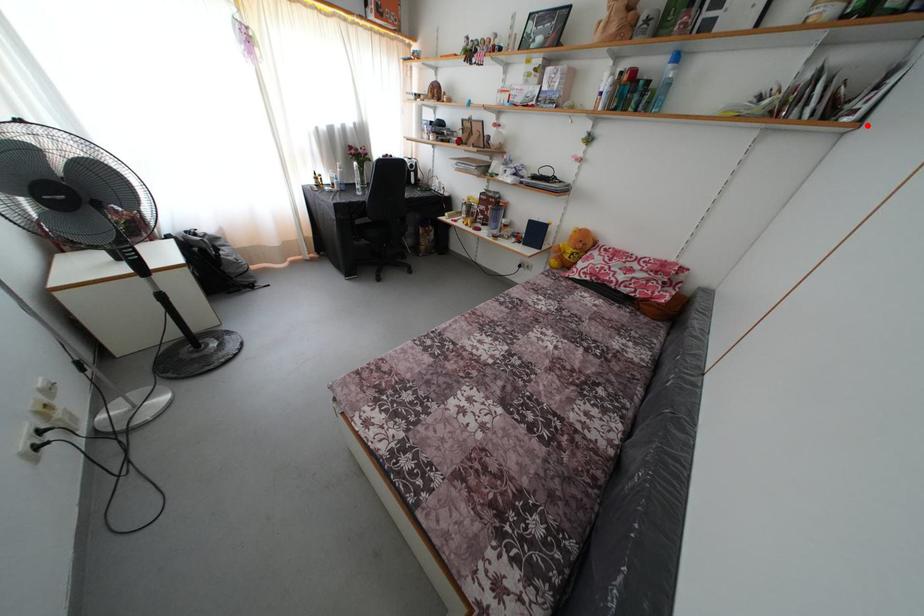
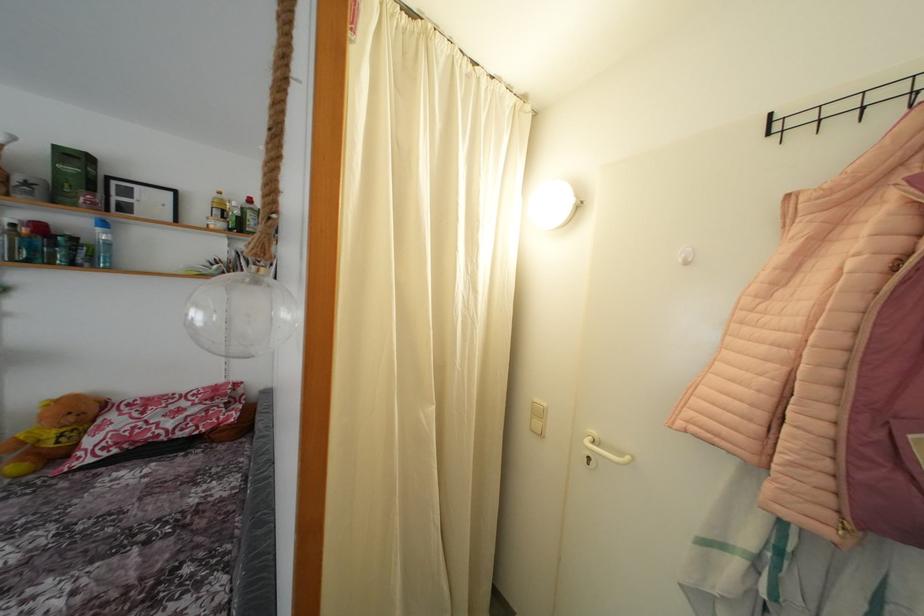
Question: I am providing you with two images of the same scene from different viewpoints. Image1 has a red point marked. In image2, the corresponding 3D location appears at what relative position? Reply with the corresponding letter.

Choices:
 (A) Closer
 (B) Farther

Answer: (A)